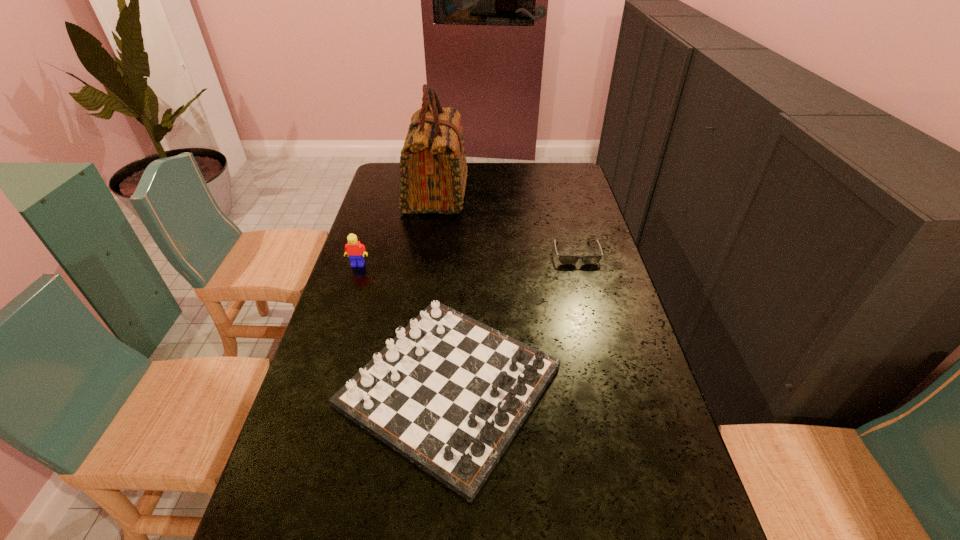
The height and width of the screenshot is (540, 960). What are the coordinates of `free location that satisfies the following two spatial constraints: 1. on the open handle side of the chessboard; 2. on the right side of the farthest object` in the screenshot? It's located at (409, 386).

Where is `vacant area in the image that satisfies the following two spatial constraints: 1. on the open handle side of the shopping bag; 2. on the front-facing side of the third shortest object`? Image resolution: width=960 pixels, height=540 pixels. vacant area in the image that satisfies the following two spatial constraints: 1. on the open handle side of the shopping bag; 2. on the front-facing side of the third shortest object is located at coordinates (426, 265).

This screenshot has width=960, height=540. Identify the location of vacant region that satisfies the following two spatial constraints: 1. on the open handle side of the shopping bag; 2. on the front-facing side of the leftmost object. (426, 265).

Locate an element on the screen. This screenshot has width=960, height=540. free space that satisfies the following two spatial constraints: 1. on the open handle side of the farthest object; 2. on the front-facing side of the leftmost object is located at coordinates (426, 265).

Locate an element on the screen. The width and height of the screenshot is (960, 540). vacant space that satisfies the following two spatial constraints: 1. on the open handle side of the farthest object; 2. on the front-facing side of the third shortest object is located at coordinates (426, 265).